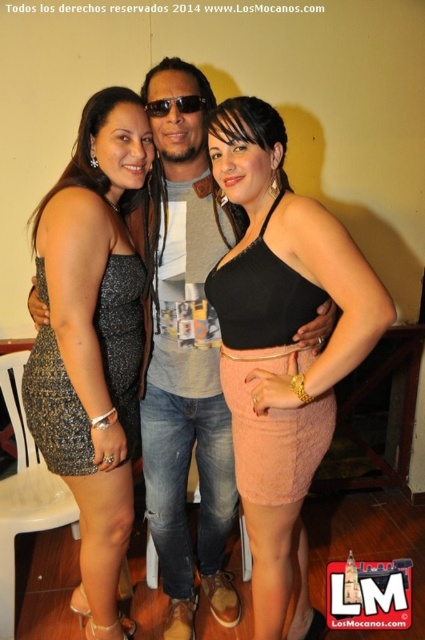
You are a photographer at the event and want to ensure that both the sparkly silver dress at left and the black plastic sunglasses at center are clearly visible in the photo. Considering their sizes, which object should you focus on first to ensure proper focus?

The sparkly silver dress at left is much taller than the black plastic sunglasses at center, so you should focus on the sparkly silver dress at left first to ensure proper focus.

What are the coordinates of the black fabric skirt at center?

The black fabric skirt at center is located at coordinates (282, 348).

Based on the coordinates provided, which object does the point at (x=93, y=337) correspond to in the scene?

The point at (x=93, y=337) corresponds to the sparkly silver dress at left.